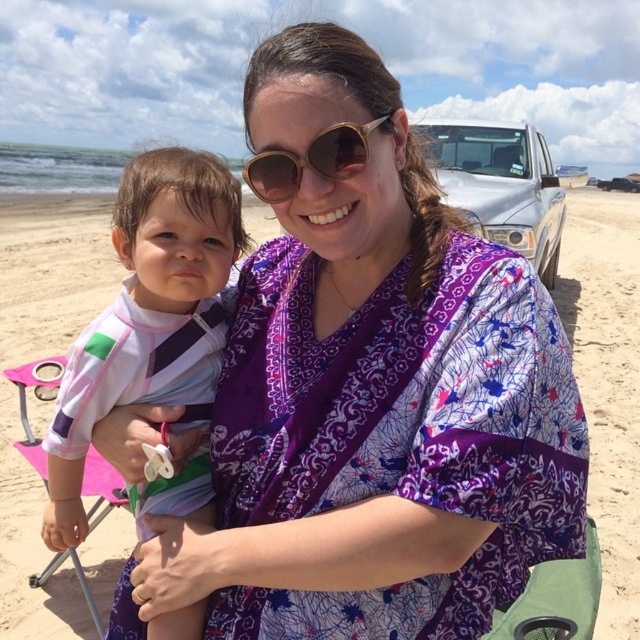
Question: Is beige sand at center positioned in front of white striped rash guard at center?

Choices:
 (A) no
 (B) yes

Answer: (A)

Question: Does beige sand at center lie in front of gold metallic sunglasses at center?

Choices:
 (A) no
 (B) yes

Answer: (A)

Question: Which point appears closest to the camera in this image?

Choices:
 (A) (12, 305)
 (B) (196, 156)

Answer: (B)

Question: Does beige sand at center have a lesser width compared to white striped rash guard at center?

Choices:
 (A) yes
 (B) no

Answer: (B)

Question: Which of the following is the farthest from the observer?

Choices:
 (A) (250, 163)
 (B) (22, 256)
 (C) (68, 532)

Answer: (B)

Question: Which point is farther to the camera?

Choices:
 (A) beige sand at center
 (B) white striped rash guard at center
 (C) gold metallic sunglasses at center

Answer: (A)